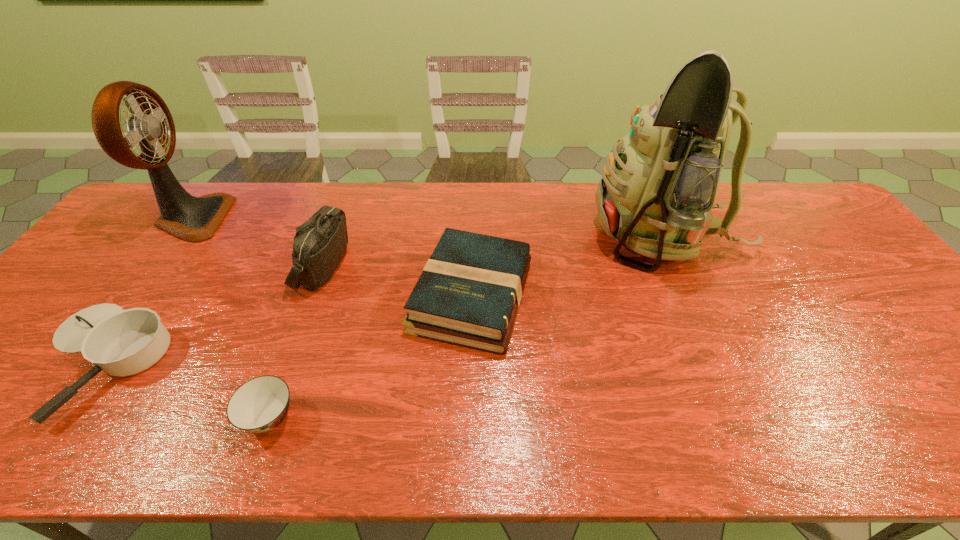
I want to click on vacant region located 0.200m on the front-facing side of the fan, so click(288, 218).

Locate an element on the screen. The width and height of the screenshot is (960, 540). vacant area situated at the front padded panel of the shoulder bag is located at coordinates (458, 265).

Find the location of a particular element. This screenshot has height=540, width=960. vacant space located on the back of the hardback book is located at coordinates (474, 186).

Locate an element on the screen. free space located on the right of the soup bowl is located at coordinates (397, 417).

The height and width of the screenshot is (540, 960). I want to click on backpack located in the far edge section of the desktop, so 658,187.

The height and width of the screenshot is (540, 960). I want to click on fan situated at the far edge, so click(x=194, y=219).

Locate an element on the screen. This screenshot has width=960, height=540. object situated at the near edge is located at coordinates (259, 405).

At what (x,y) coordinates should I click in order to perform the action: click on object that is at the left edge. Please return your answer as a coordinate pair (x, y). The image size is (960, 540). Looking at the image, I should click on (194, 219).

The height and width of the screenshot is (540, 960). I want to click on object at the far left corner, so click(x=194, y=219).

In the image, there is a desktop. Where is `vacant area at the far edge`? This screenshot has height=540, width=960. vacant area at the far edge is located at coordinates (488, 218).